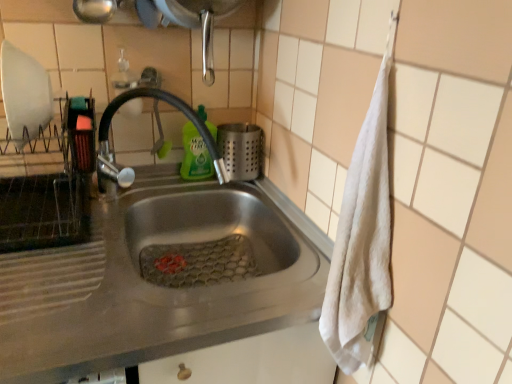
At what (x,y) coordinates should I click in order to perform the action: click on vacant space that is to the left of satin silver utensil holder at sink. Please return your answer as a coordinate pair (x, y). Looking at the image, I should click on (178, 185).